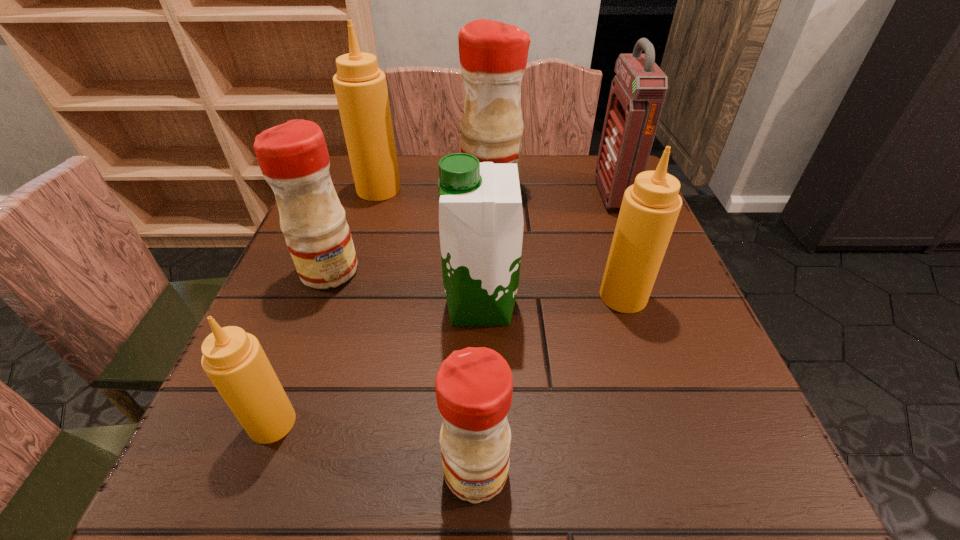
Where is `free space located on the back of the smallest tan condiment`? This screenshot has height=540, width=960. free space located on the back of the smallest tan condiment is located at coordinates (312, 318).

Where is `vacant space located 0.190m on the left of the smallest red condiment`? The width and height of the screenshot is (960, 540). vacant space located 0.190m on the left of the smallest red condiment is located at coordinates (300, 471).

This screenshot has width=960, height=540. Find the location of `the first-aid kit at the far edge`. the first-aid kit at the far edge is located at coordinates (638, 91).

Image resolution: width=960 pixels, height=540 pixels. I want to click on object that is at the near edge, so click(474, 386).

Where is `the first-aid kit that is at the right edge`? The height and width of the screenshot is (540, 960). the first-aid kit that is at the right edge is located at coordinates (638, 91).

Find the location of a particular element. condiment positioned at the right edge is located at coordinates (650, 207).

Locate an element on the screen. The height and width of the screenshot is (540, 960). object situated at the far left corner is located at coordinates (360, 86).

Where is `object at the far right corner`? This screenshot has width=960, height=540. object at the far right corner is located at coordinates (638, 91).

The image size is (960, 540). In order to click on vacant space at the far edge in this screenshot , I will do `click(563, 161)`.

In the image, there is a desktop. In order to click on vacant space at the near edge in this screenshot , I will do `click(483, 516)`.